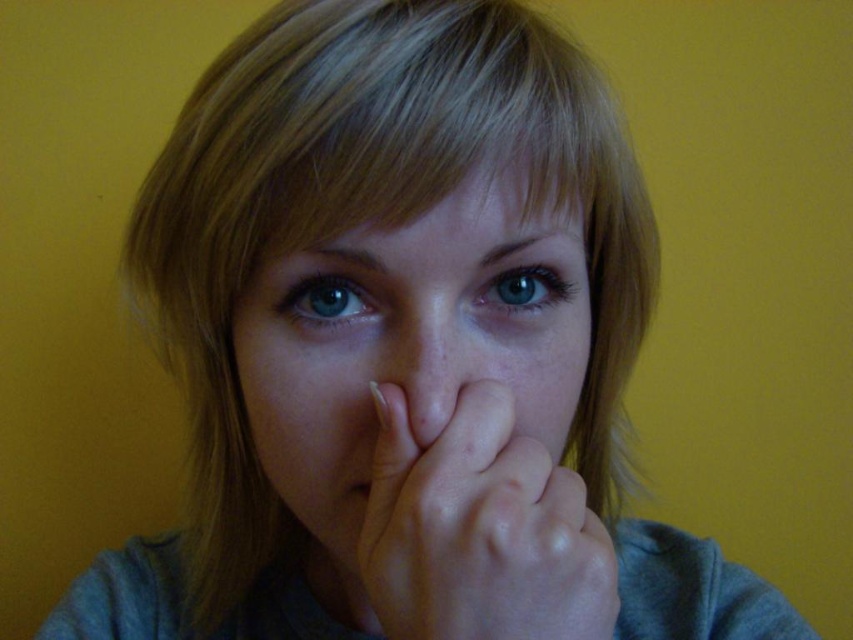
Based on the scene description, can you determine if the smooth skin hand at center is wider than the blue glossy eye at center?

The smooth skin hand at center might be wider than blue glossy eye at center according to the objects description.

Based on the scene description, which object is closer to the viewer between the smooth skin face at center and the matte skin at center?

The smooth skin face at center is closer to the viewer than the matte skin at center.

Looking at the image, which object is larger between the smooth skin face at center and the smooth skin hand at center?

The smooth skin face at center is bigger than the smooth skin hand at center.